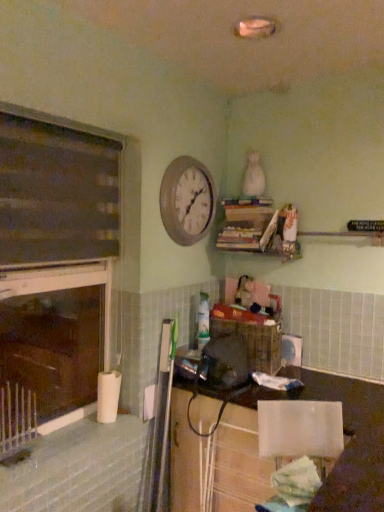
What do you see at coordinates (16, 419) in the screenshot? I see `silver metallic radiator at lower left` at bounding box center [16, 419].

The width and height of the screenshot is (384, 512). In order to click on white fabric chair at lower right in this screenshot , I will do `click(299, 443)`.

Where is `wooden clock at upper center`? wooden clock at upper center is located at coordinates (187, 200).

You are a GUI agent. You are given a task and a screenshot of the screen. Output one action in this format:
    pyautogui.click(x=<x>, y=<y>)
    Task: Click on the white glossy lampshade at lower right
    This screenshot has width=384, height=512.
    Given the screenshot: What is the action you would take?
    pyautogui.click(x=218, y=462)

Find the location of `silver metallic radiator at lower left`. silver metallic radiator at lower left is located at coordinates (16, 419).

Considering the relative positions of dark wood window frame at left and white fabric chair at lower right in the image provided, is dark wood window frame at left to the left of white fabric chair at lower right from the viewer's perspective?

Yes, dark wood window frame at left is to the left of white fabric chair at lower right.

From the image's perspective, relative to white fabric chair at lower right, is dark wood window frame at left above or below?

dark wood window frame at left is above white fabric chair at lower right.

From a real-world perspective, does dark wood window frame at left stand above white fabric chair at lower right?

Correct, in the physical world, dark wood window frame at left is higher than white fabric chair at lower right.

Considering the relative sizes of wooden clock at upper center and dark wood window frame at left in the image provided, is wooden clock at upper center shorter than dark wood window frame at left?

Correct, wooden clock at upper center is not as tall as dark wood window frame at left.

Image resolution: width=384 pixels, height=512 pixels. Identify the location of window frame that appears on the left of wooden clock at upper center. (56, 255).

Between point (165, 182) and point (24, 213), which one is positioned in front?

Positioned in front is point (24, 213).

Consider the image. Is wooden clock at upper center oriented away from dark wood window frame at left?

wooden clock at upper center is not turned away from dark wood window frame at left.

Can we say dark wood window frame at left lies outside silver metallic radiator at lower left?

Yes, dark wood window frame at left is located beyond the bounds of silver metallic radiator at lower left.

Does dark wood window frame at left appear on the right side of silver metallic radiator at lower left?

Yes.

Looking at this image, between white fabric chair at lower right and dark wood window frame at left, which one has larger size?

dark wood window frame at left.

Considering the relative sizes of white fabric chair at lower right and dark wood window frame at left in the image provided, is white fabric chair at lower right thinner than dark wood window frame at left?

In fact, white fabric chair at lower right might be wider than dark wood window frame at left.

Is point (302, 489) closer or farther from the camera than point (25, 224)?

Point (302, 489) is positioned closer to the camera compared to point (25, 224).

Is the surface of white fabric chair at lower right in direct contact with dark wood window frame at left?

white fabric chair at lower right is not next to dark wood window frame at left, and they're not touching.

Is white fabric chair at lower right positioned beyond the bounds of silver metallic radiator at lower left?

Indeed, white fabric chair at lower right is completely outside silver metallic radiator at lower left.

Is white fabric chair at lower right smaller than silver metallic radiator at lower left?

Indeed, white fabric chair at lower right has a smaller size compared to silver metallic radiator at lower left.

Considering the points (283, 452) and (10, 434), which point is in front, point (283, 452) or point (10, 434)?

Point (283, 452)

Would you consider white fabric chair at lower right to be distant from white glossy lampshade at lower right?

They are positioned close to each other.

Which of these two, white fabric chair at lower right or white glossy lampshade at lower right, is wider?

Wider between the two is white fabric chair at lower right.

Is point (266, 417) farther from viewer compared to point (271, 461)?

No.

From the image's perspective, is white fabric chair at lower right on white glossy lampshade at lower right?

Yes, from the image's perspective, white fabric chair at lower right is over white glossy lampshade at lower right.

From a real-world perspective, between white glossy lampshade at lower right and silver metallic radiator at lower left, who is vertically higher?

From a 3D spatial view, silver metallic radiator at lower left is above.

Consider the image. Is white glossy lampshade at lower right looking in the opposite direction of silver metallic radiator at lower left?

No, white glossy lampshade at lower right is not facing the opposite direction of silver metallic radiator at lower left.

Would you say white glossy lampshade at lower right is a long distance from silver metallic radiator at lower left?

No, there isn't a large distance between white glossy lampshade at lower right and silver metallic radiator at lower left.

Find the location of a particular element. The width and height of the screenshot is (384, 512). radiator located above the white glossy lampshade at lower right (from the image's perspective) is located at coordinates (16, 419).

Where is `window frame on the left of white fabric chair at lower right`? window frame on the left of white fabric chair at lower right is located at coordinates (56, 255).

In the image, there is a dark wood window frame at left. In order to click on clock above it (from the image's perspective) in this screenshot , I will do `click(187, 200)`.

From the image, which object appears to be farther from white fabric chair at lower right, silver metallic radiator at lower left or dark wood window frame at left?

dark wood window frame at left is positioned further to the anchor white fabric chair at lower right.

Based on their spatial positions, is white glossy lampshade at lower right or wooden clock at upper center further from white fabric chair at lower right?

wooden clock at upper center is positioned further to the anchor white fabric chair at lower right.

From the image, which object appears to be nearer to white fabric chair at lower right, white glossy lampshade at lower right or silver metallic radiator at lower left?

white glossy lampshade at lower right is positioned closer to the anchor white fabric chair at lower right.

When comparing their distances from white fabric chair at lower right, does wooden clock at upper center or white glossy lampshade at lower right seem further?

wooden clock at upper center lies further to white fabric chair at lower right than the other object.

Based on their spatial positions, is dark wood window frame at left or wooden clock at upper center closer to white glossy lampshade at lower right?

Among the two, dark wood window frame at left is located nearer to white glossy lampshade at lower right.

Looking at this image, based on their spatial positions, is wooden clock at upper center or white fabric chair at lower right closer to dark wood window frame at left?

The object closer to dark wood window frame at left is wooden clock at upper center.

When comparing their distances from silver metallic radiator at lower left, does dark wood window frame at left or white glossy lampshade at lower right seem further?

white glossy lampshade at lower right is further to silver metallic radiator at lower left.

Estimate the real-world distances between objects in this image. Which object is further from dark wood window frame at left, white fabric chair at lower right or silver metallic radiator at lower left?

white fabric chair at lower right.

Find the location of a particular element. window frame between silver metallic radiator at lower left and white fabric chair at lower right in the horizontal direction is located at coordinates [56, 255].

I want to click on window frame between wooden clock at upper center and white fabric chair at lower right from top to bottom, so click(56, 255).

Find the location of a particular element. chair between wooden clock at upper center and white glossy lampshade at lower right vertically is located at coordinates (299, 443).

You are a GUI agent. You are given a task and a screenshot of the screen. Output one action in this format:
    pyautogui.click(x=<x>, y=<y>)
    Task: Click on the radiator between wooden clock at upper center and white fabric chair at lower right from top to bottom
    Image resolution: width=384 pixels, height=512 pixels.
    Given the screenshot: What is the action you would take?
    pyautogui.click(x=16, y=419)